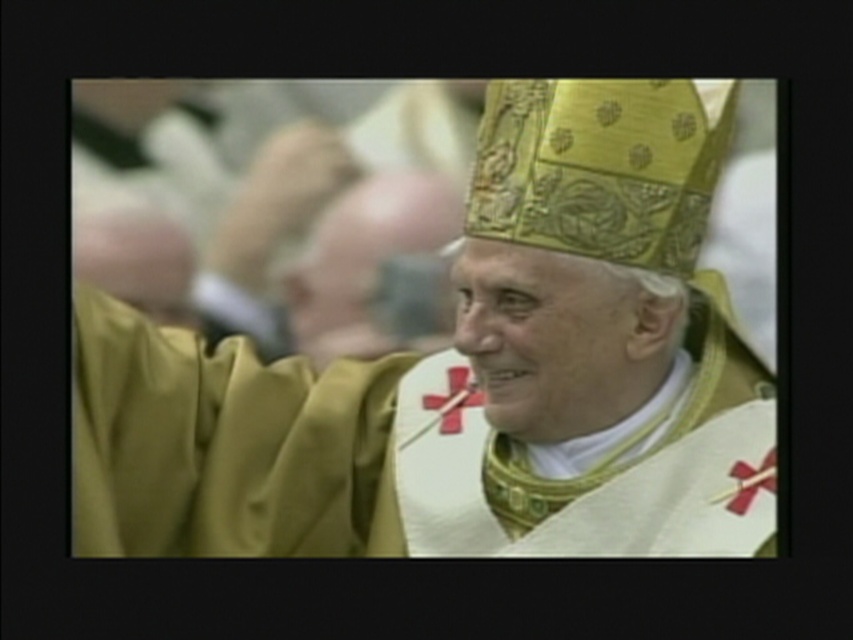
Question: Is gold textured mitre at center above red matte cross at center?

Choices:
 (A) no
 (B) yes

Answer: (B)

Question: Observing the image, what is the correct spatial positioning of gold textured mitre at center in reference to gold textured robe at center?

Choices:
 (A) above
 (B) below

Answer: (B)

Question: Where is gold textured mitre at center located in relation to gold textured robe at center in the image?

Choices:
 (A) below
 (B) above

Answer: (A)

Question: Based on their relative distances, which object is nearer to the red matte cross at center?

Choices:
 (A) gold textured robe at center
 (B) gold textured mitre at center

Answer: (B)

Question: Which of these objects is positioned closest to the gold textured mitre at center?

Choices:
 (A) gold textured robe at center
 (B) red matte cross at center

Answer: (B)

Question: Which object is positioned closest to the red matte cross at center?

Choices:
 (A) gold textured mitre at center
 (B) gold textured robe at center

Answer: (A)